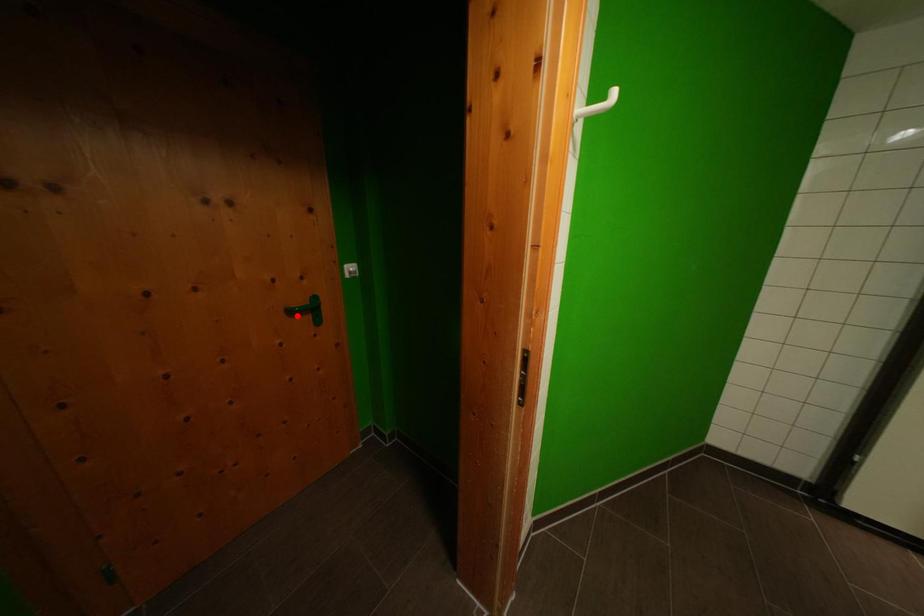
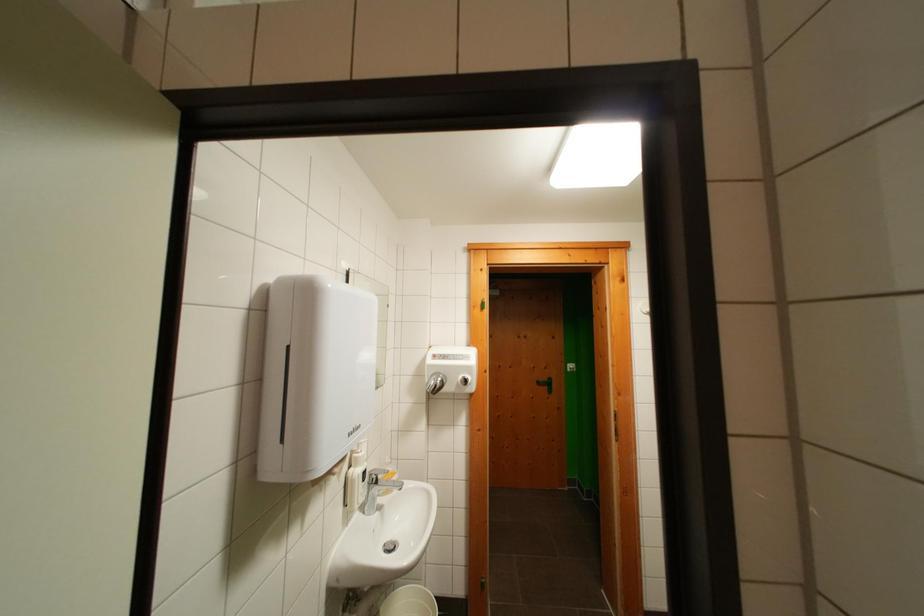
Where in the second image is the point corresponding to the highlighted location from the first image?

(544, 387)